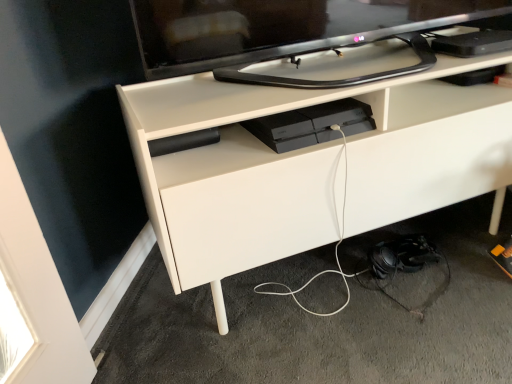
In order to click on free area below white matte desk at center (from a real-world perspective) in this screenshot , I will do `click(346, 261)`.